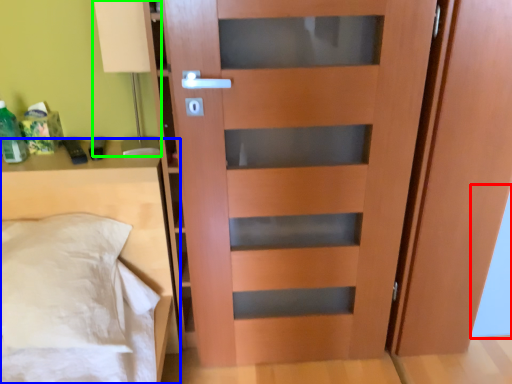
Question: Estimate the real-world distances between objects in this image. Which object is closer to glass door (highlighted by a red box), furniture (highlighted by a blue box) or table lamp (highlighted by a green box)?

Choices:
 (A) furniture
 (B) table lamp

Answer: (A)